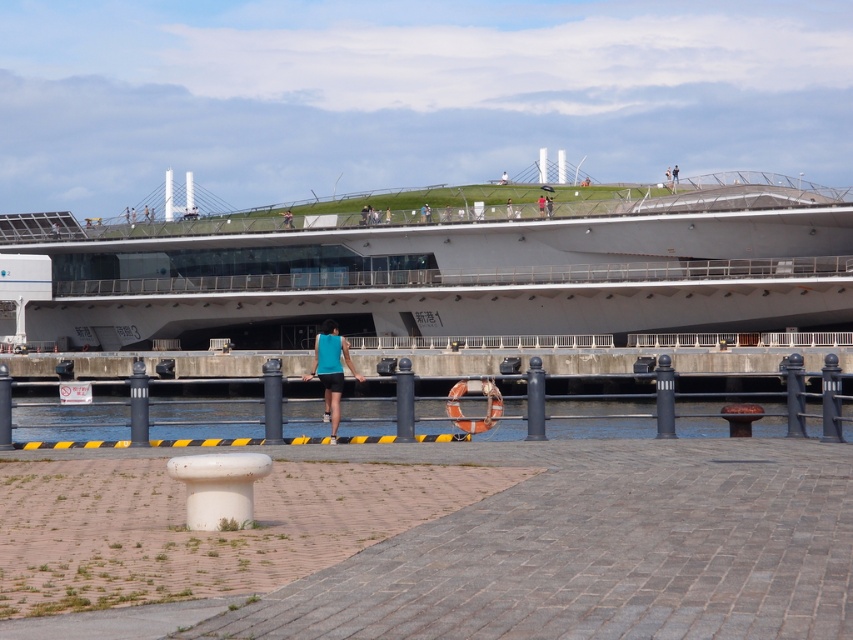
Question: Based on their relative distances, which object is farther from the clear water at dock center?

Choices:
 (A) teal fabric tank top at center
 (B) white glossy cruise ship at upper center

Answer: (B)

Question: Which object is farther from the camera taking this photo?

Choices:
 (A) white glossy cruise ship at upper center
 (B) clear water at dock center

Answer: (A)

Question: Among these points, which one is nearest to the camera?

Choices:
 (A) (225, 428)
 (B) (317, 337)
 (C) (48, 285)

Answer: (B)

Question: Observing the image, what is the correct spatial positioning of clear water at dock center in reference to teal fabric tank top at center?

Choices:
 (A) above
 (B) below

Answer: (B)

Question: Where is clear water at dock center located in relation to teal fabric tank top at center in the image?

Choices:
 (A) right
 (B) left

Answer: (A)

Question: Is clear water at dock center below teal fabric tank top at center?

Choices:
 (A) yes
 (B) no

Answer: (A)